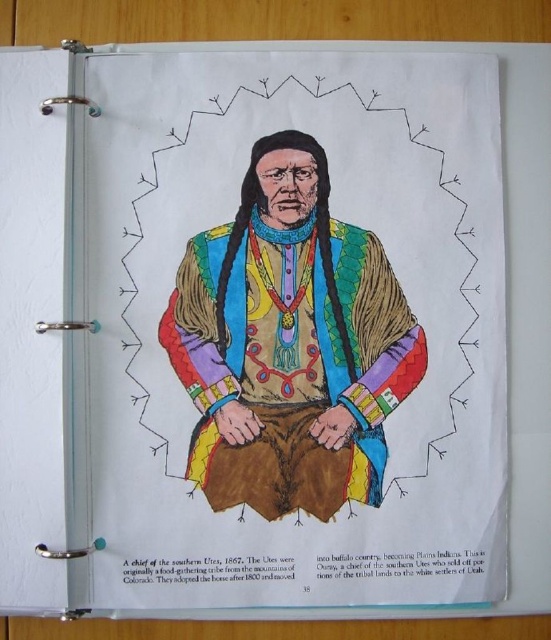
Between multicolored fur vest at center and black paper at bottom, which one has more height?

multicolored fur vest at center is taller.

Is multicolored fur vest at center further to the viewer compared to black paper at bottom?

That is True.

Identify the location of multicolored fur vest at center. (289, 342).